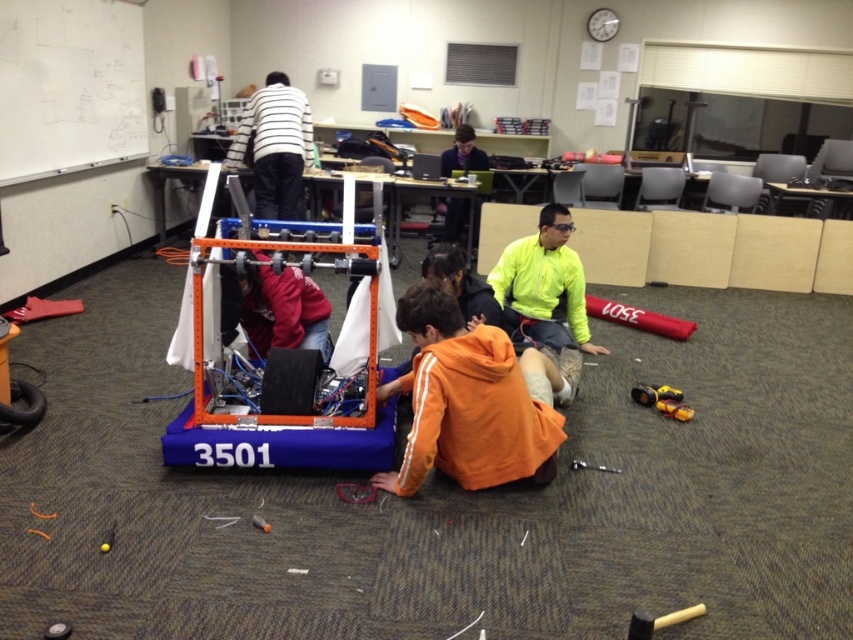
You are standing at point (253,172) and want to walk to the orange and blue robot labeled 3501. Is the point (537,358) in front of you or behind you?

Point (537,358) is in front of point (253,172), so it is in front of you as you walk toward the orange and blue robot labeled 3501.

You are a photographer standing 2 meters away from the camera. You want to take a photo of the neon yellow jacket at center. Is the camera close enough to capture the jacket without moving closer?

The neon yellow jacket at center and camera are 3.78 meters apart. Since you are already 2 meters away from the camera, the total distance between you and the jacket is 5.78 meters. However, the question is about the camera and jacket distance. The camera is 3.78 meters away from the jacket, so if the camera has sufficient zoom, it can capture the jacket from that distance without needing to move closer.

You are a visitor in the robotics workshop and see two people wearing jackets with distinct colors. Which jacket is positioned to the right when looking at the neon yellow jacket at center and the matte red jacket at center?

The neon yellow jacket at center is to the right of the matte red jacket at center.